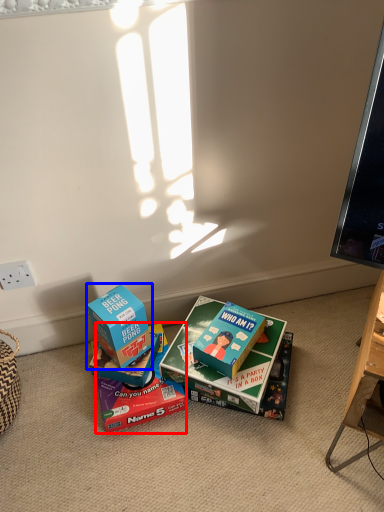
Question: Which object appears closest to the camera in this image, box (highlighted by a red box) or box (highlighted by a blue box)?

Choices:
 (A) box
 (B) box

Answer: (B)